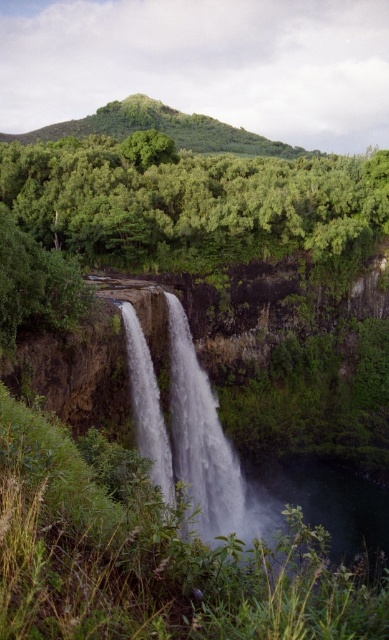
Question: Is white frothy water at center below green leafy hillside at upper center?

Choices:
 (A) yes
 (B) no

Answer: (A)

Question: Is green leafy trees at upper center wider than green leafy hillside at upper center?

Choices:
 (A) yes
 (B) no

Answer: (B)

Question: Which of the following is the farthest from the observer?

Choices:
 (A) green leafy trees at upper center
 (B) green leafy hillside at upper center

Answer: (B)

Question: Which point appears farthest from the camera in this image?

Choices:
 (A) (198, 449)
 (B) (381, 225)

Answer: (B)

Question: Which point appears farthest from the camera in this image?

Choices:
 (A) (240, 250)
 (B) (171, 400)
 (C) (187, 129)

Answer: (C)

Question: Does white frothy water at center lie behind green leafy hillside at upper center?

Choices:
 (A) yes
 (B) no

Answer: (B)